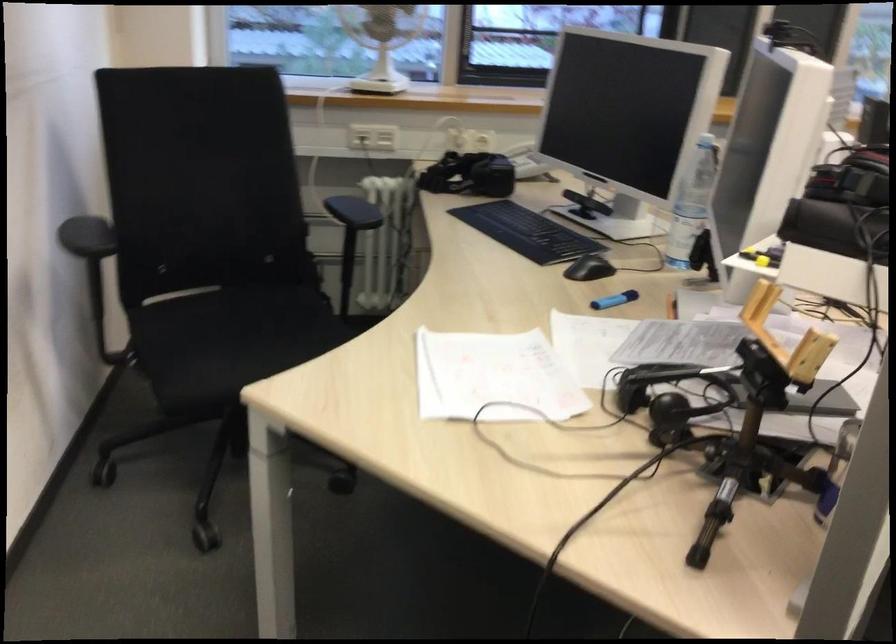
Image resolution: width=896 pixels, height=644 pixels. What are the coordinates of `blue cap marker` in the screenshot? It's located at (615, 299).